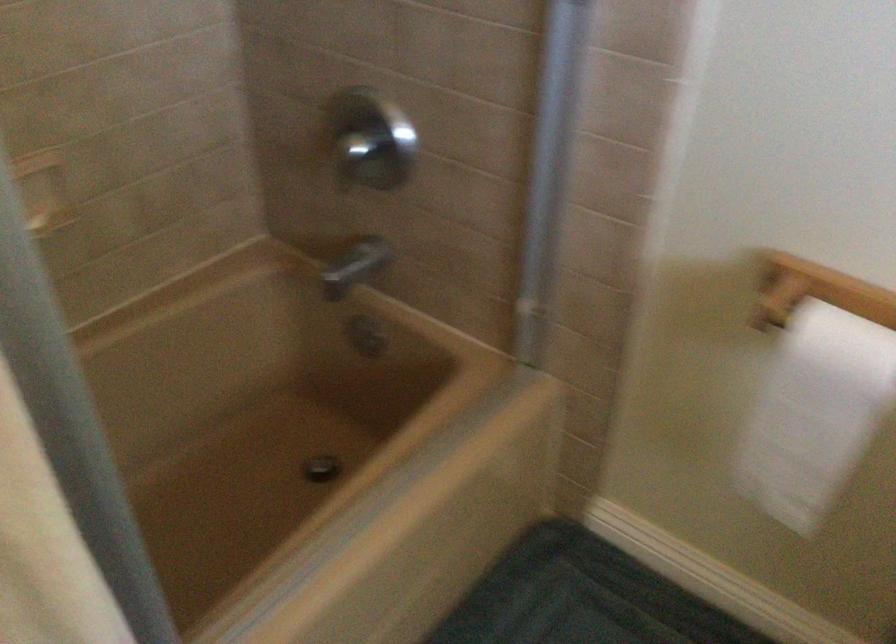
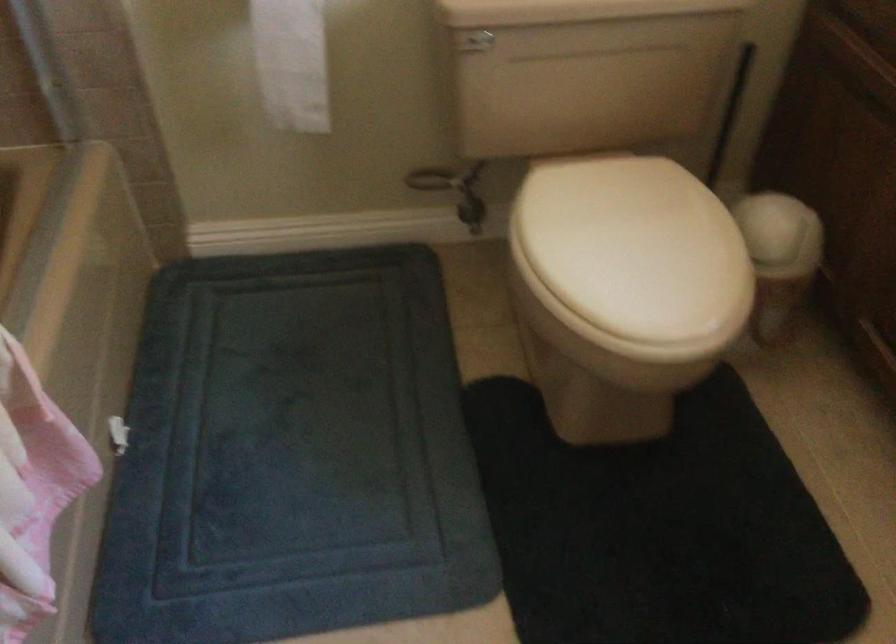
Question: How did the camera likely rotate?

Choices:
 (A) Left
 (B) Right
 (C) Up
 (D) Down

Answer: (B)